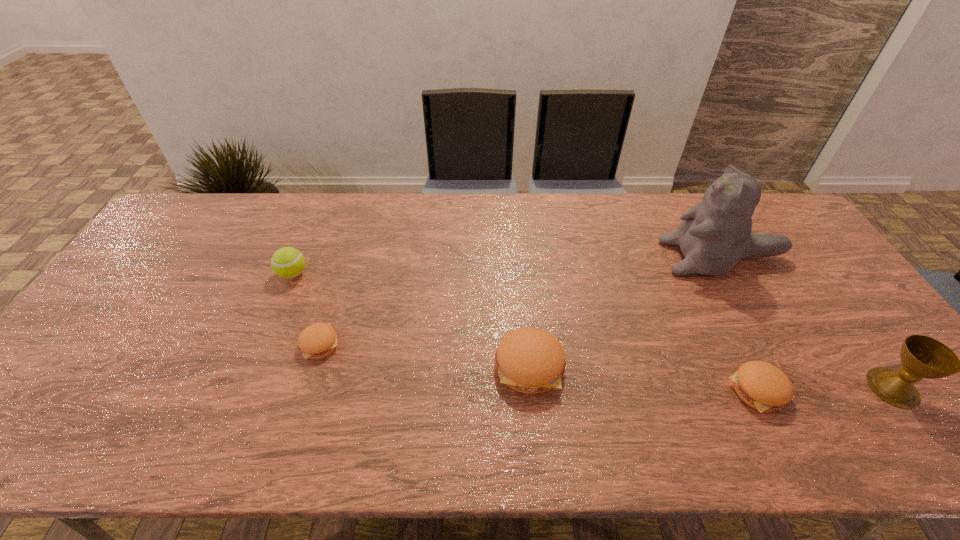
Identify the location of free space that is in between the fifth shortest object and the fourth object from right to left. This screenshot has height=540, width=960. (x=711, y=377).

I want to click on vacant space that is in between the cat and the fifth shortest object, so click(x=808, y=322).

Where is `vacant space that is in between the cat and the rightmost patty`? vacant space that is in between the cat and the rightmost patty is located at coordinates (740, 323).

Locate an element on the screen. The height and width of the screenshot is (540, 960). free spot between the cat and the tennis ball is located at coordinates pyautogui.click(x=508, y=266).

Find the location of a particular element. The width and height of the screenshot is (960, 540). vacant area that lies between the fourth object from right to left and the second tallest object is located at coordinates (711, 377).

In order to click on unoccupied position between the cat and the second object from left to right in this screenshot , I will do `click(521, 300)`.

Locate an element on the screen. The height and width of the screenshot is (540, 960). object that is the third nearest to the cat is located at coordinates (530, 360).

The height and width of the screenshot is (540, 960). Identify the location of the closest object to the tallest patty. (761, 385).

Locate which patty is the closest to the tallest patty. Please provide its 2D coordinates. Your answer should be formatted as a tuple, i.e. [(x, y)], where the tuple contains the x and y coordinates of a point satisfying the conditions above.

[(761, 385)]

Identify which patty is the nearest to the second shortest patty. Please provide its 2D coordinates. Your answer should be formatted as a tuple, i.e. [(x, y)], where the tuple contains the x and y coordinates of a point satisfying the conditions above.

[(530, 360)]